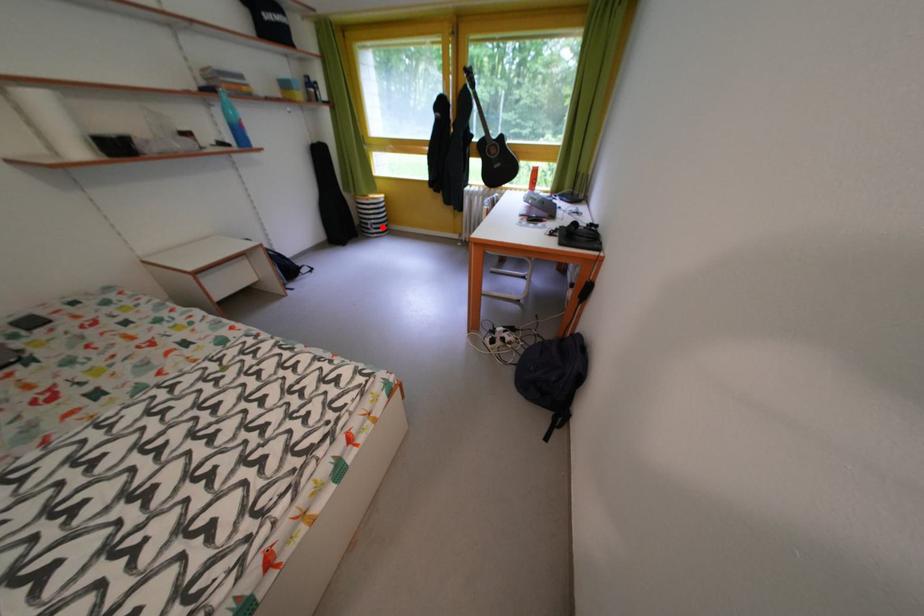
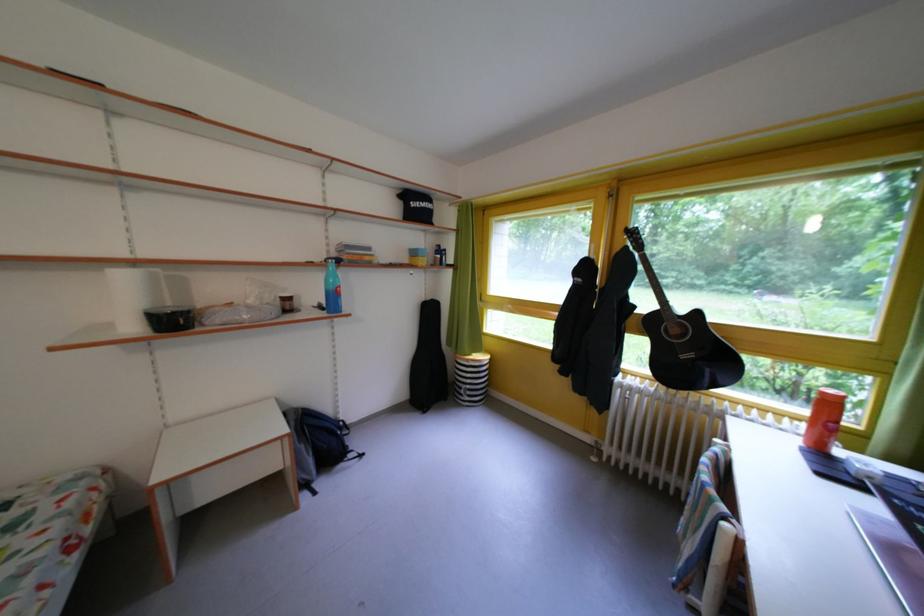
Question: I am providing you with two images of the same scene from different viewpoints. Given a red point in image1, look at the same physical point in image2. Is it:

Choices:
 (A) Closer to the viewpoint
 (B) Farther from the viewpoint

Answer: (B)